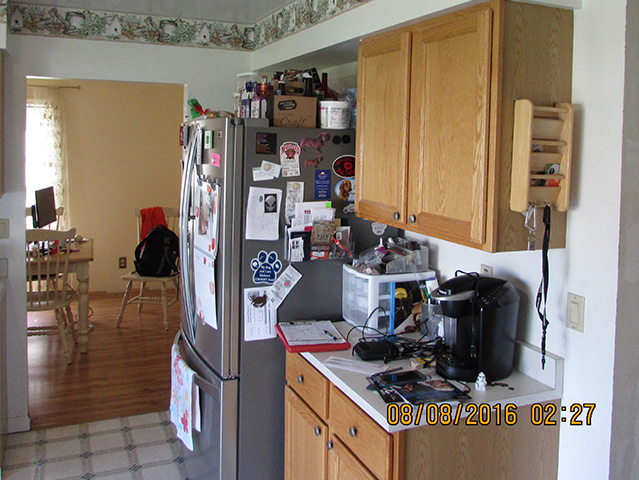
Where is `cabinet`? This screenshot has width=639, height=480. cabinet is located at coordinates (390, 124), (434, 125), (303, 441), (340, 465).